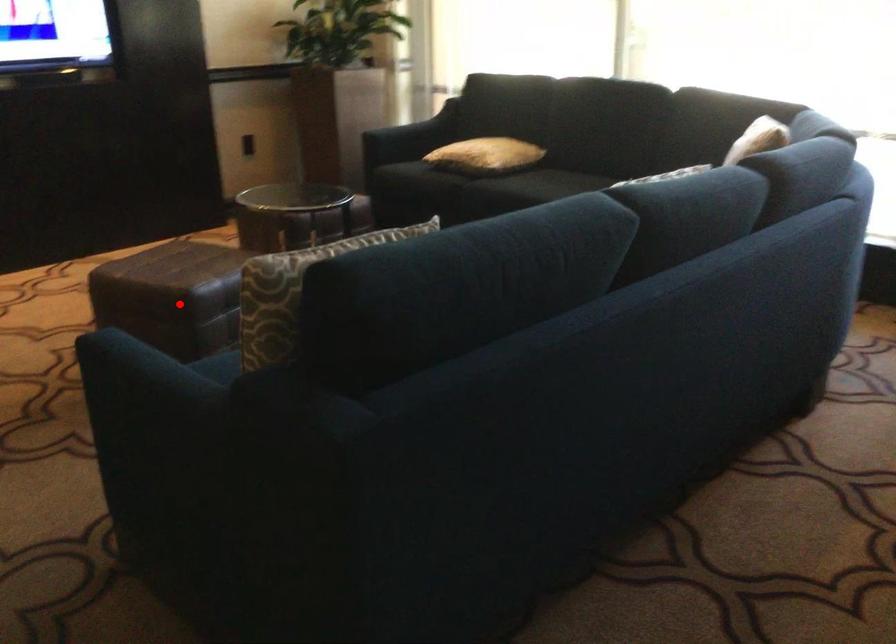
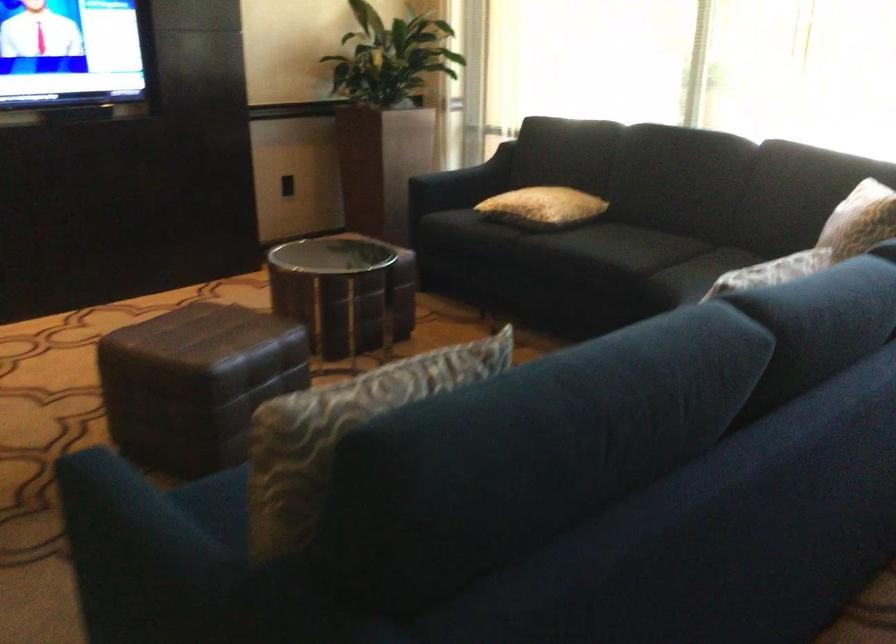
Question: I am providing you with two images of the same scene from different viewpoints. In image1, a red point is highlighted. Considering the same 3D point in image2, which of the following is correct?

Choices:
 (A) It is closer
 (B) It is farther

Answer: (A)